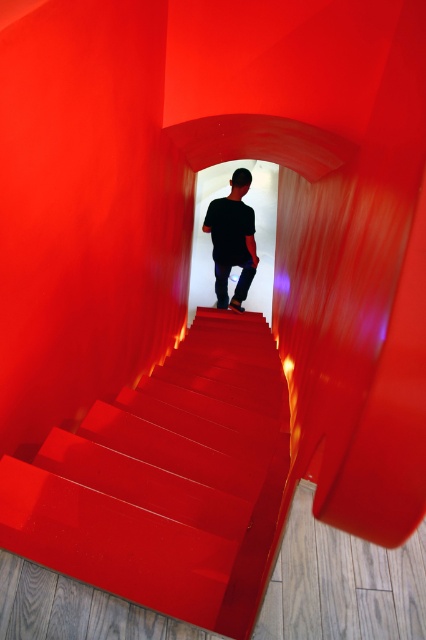
Question: Where is glossy red stairs at center located in relation to black matte shirt at center in the image?

Choices:
 (A) right
 (B) left

Answer: (B)

Question: Which point is farther to the camera?

Choices:
 (A) black matte shirt at center
 (B) glossy red stairs at center

Answer: (A)

Question: Which point is closer to the camera?

Choices:
 (A) glossy red stairs at center
 (B) black matte shirt at center

Answer: (A)

Question: Which point appears closest to the camera in this image?

Choices:
 (A) (118, 525)
 (B) (216, 289)

Answer: (A)

Question: Does glossy red stairs at center appear under black matte shirt at center?

Choices:
 (A) yes
 (B) no

Answer: (A)

Question: Does glossy red stairs at center appear on the left side of black matte shirt at center?

Choices:
 (A) no
 (B) yes

Answer: (B)